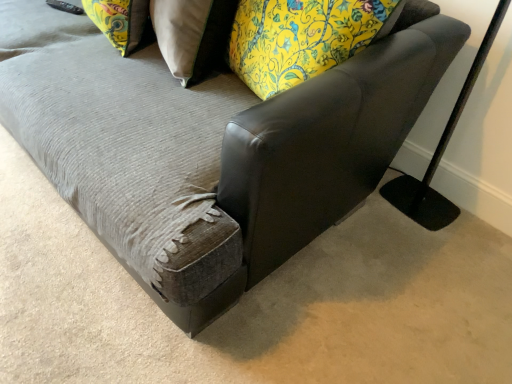
Question: Does point (124, 39) appear closer or farther from the camera than point (247, 117)?

Choices:
 (A) closer
 (B) farther

Answer: (B)

Question: Is floral fabric pillow at upper left, the second pillow viewed from the right, taller or shorter than leather swivel chair at center?

Choices:
 (A) tall
 (B) short

Answer: (B)

Question: Considering the real-world distances, which object is closest to the floral fabric pillow at upper left, the second pillow viewed from the right?

Choices:
 (A) leather swivel chair at center
 (B) floral fabric pillow at upper center, the 1th pillow when ordered from right to left
 (C) black matte table lamp at right

Answer: (B)

Question: Which of these objects is positioned farthest from the floral fabric pillow at upper center, placed as the 2th pillow when sorted from left to right?

Choices:
 (A) floral fabric pillow at upper left, the second pillow viewed from the right
 (B) leather swivel chair at center
 (C) black matte table lamp at right

Answer: (C)